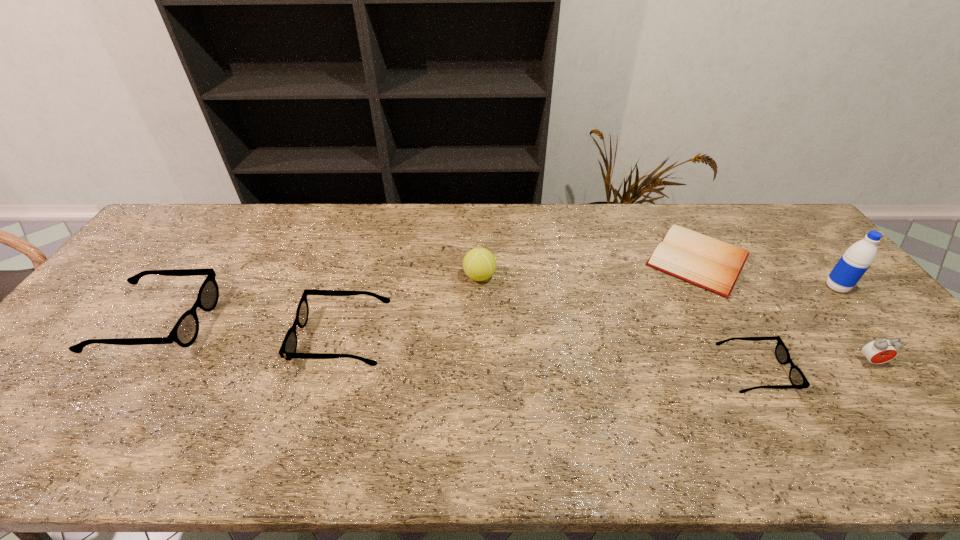
Identify the location of the leftmost object. This screenshot has width=960, height=540. (184, 333).

I want to click on the sixth object from right to left, so click(288, 348).

Locate an element on the screen. the fifth tallest object is located at coordinates (288, 348).

The height and width of the screenshot is (540, 960). What are the coordinates of `the rightmost spectacles` in the screenshot? It's located at (798, 380).

What are the coordinates of `the sixth tallest object` in the screenshot? It's located at (798, 380).

The width and height of the screenshot is (960, 540). I want to click on the shortest object, so click(x=714, y=265).

Find the location of `the rightmost object`. the rightmost object is located at coordinates (857, 259).

Locate an element on the screen. This screenshot has width=960, height=540. water bottle is located at coordinates pos(857,259).

Find the location of a particular element. The image size is (960, 540). the third object from left to right is located at coordinates (479, 264).

The width and height of the screenshot is (960, 540). Identify the location of the sixth object from left to right. (878, 351).